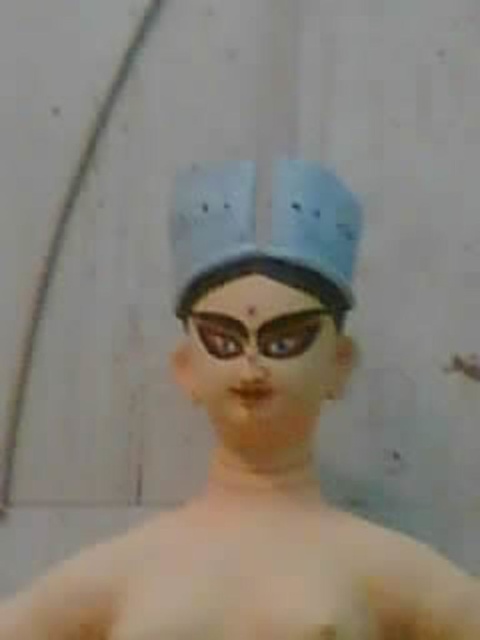
Question: Which point is closer to the camera?

Choices:
 (A) matte blue hat at center
 (B) matte black goggles at center

Answer: (A)

Question: Is matte blue hat at center further to camera compared to matte black goggles at center?

Choices:
 (A) no
 (B) yes

Answer: (A)

Question: Which object is farther from the camera taking this photo?

Choices:
 (A) matte black goggles at center
 (B) matte blue hat at center

Answer: (A)

Question: Is matte blue hat at center above matte black goggles at center?

Choices:
 (A) no
 (B) yes

Answer: (B)

Question: Does matte blue hat at center come behind matte black goggles at center?

Choices:
 (A) no
 (B) yes

Answer: (A)

Question: Which point is closer to the camera?

Choices:
 (A) (197, 330)
 (B) (192, 186)

Answer: (A)